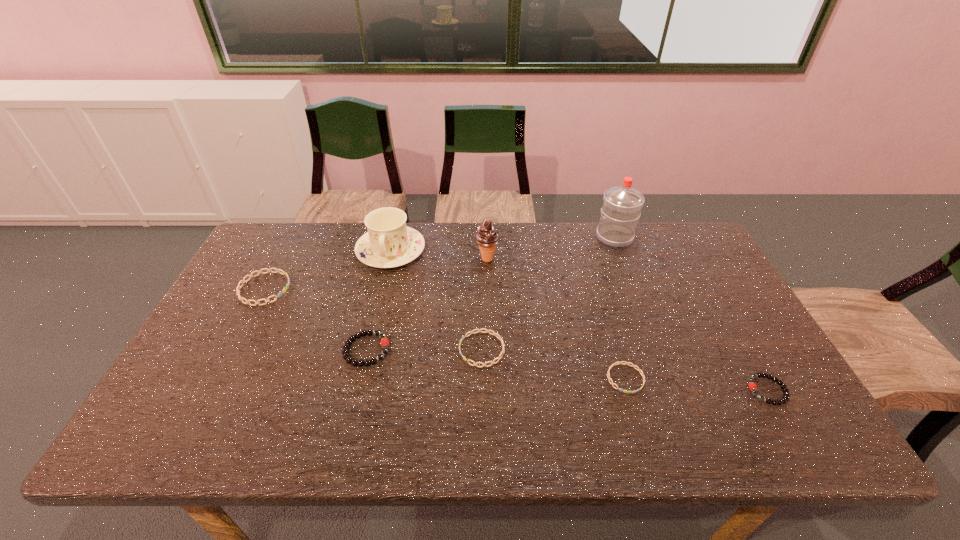
Locate an element on the screen. The width and height of the screenshot is (960, 540). vacant area situated on the surface of the third bracelet from right to left showing star-shaped elements is located at coordinates (397, 349).

You are a GUI agent. You are given a task and a screenshot of the screen. Output one action in this format:
    pyautogui.click(x=<x>, y=<y>)
    Task: Click on the free space located on the surface of the third bracelet from right to left showing star-shaped elements
    
    Given the screenshot: What is the action you would take?
    pyautogui.click(x=382, y=349)

This screenshot has height=540, width=960. Find the location of `free space located 0.080m on the left of the rightmost bracelet`. free space located 0.080m on the left of the rightmost bracelet is located at coordinates (715, 390).

Locate an element on the screen. free space located 0.120m on the surface of the smallest blue bracelet showing star-shaped elements is located at coordinates (644, 442).

This screenshot has width=960, height=540. In order to click on water bottle present at the far edge in this screenshot , I will do `click(621, 209)`.

At what (x,y) coordinates should I click in order to perform the action: click on icecream located at the far edge. Please return your answer as a coordinate pair (x, y). Looking at the image, I should click on (487, 238).

What are the coordinates of `chinaware at the far edge` in the screenshot? It's located at (389, 243).

You are a GUI agent. You are given a task and a screenshot of the screen. Output one action in this format:
    pyautogui.click(x=<x>, y=<y>)
    Task: Click on the object that is at the left edge
    Image resolution: width=960 pixels, height=540 pixels.
    Given the screenshot: What is the action you would take?
    pyautogui.click(x=243, y=281)

At what (x,y) coordinates should I click in order to perform the action: click on object that is at the right edge. Please return your answer as a coordinate pair (x, y). This screenshot has width=960, height=540. Looking at the image, I should click on (752, 386).

Where is `vacant point at the far edge`? vacant point at the far edge is located at coordinates (564, 256).